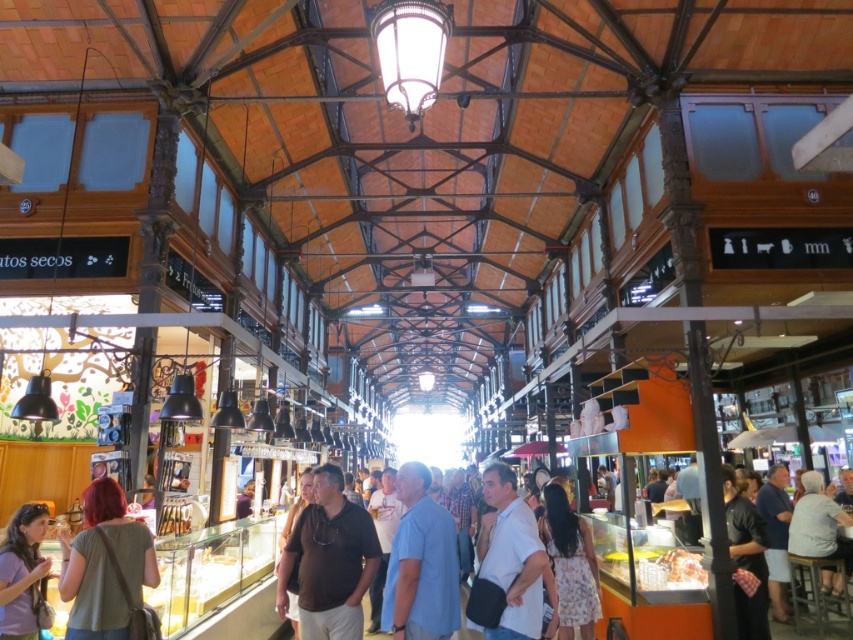
Question: Is matte gray shirt at lower left positioned in front of white cotton shirt at lower right?

Choices:
 (A) no
 (B) yes

Answer: (B)

Question: Among these points, which one is farthest from the camera?

Choices:
 (A) (318, 563)
 (B) (828, 557)
 (C) (543, 502)
 (D) (396, 481)

Answer: (D)

Question: Which object is positioned farthest from the matte gray shirt at lower left?

Choices:
 (A) blue cotton shirt at center
 (B) white cotton shirt at lower right

Answer: (B)

Question: Where is brown matte shirt at center located in relation to white cotton shirt at center in the image?

Choices:
 (A) right
 (B) left

Answer: (B)

Question: Is blue cotton shirt at center smaller than white cotton dress at center?

Choices:
 (A) no
 (B) yes

Answer: (A)

Question: Estimate the real-world distances between objects in this image. Which object is farther from the blue cotton shirt at center?

Choices:
 (A) white cotton shirt at center
 (B) white cotton shirt at lower right
 (C) white cotton dress at center
 (D) matte green shirt at lower left

Answer: (B)